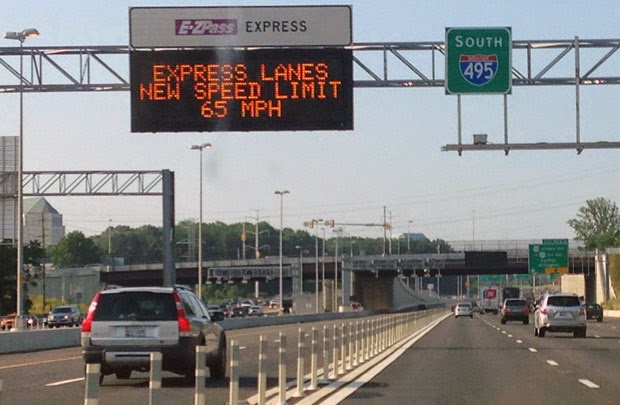
The height and width of the screenshot is (405, 620). What are the coordinates of `led` in the screenshot? It's located at (279, 85).